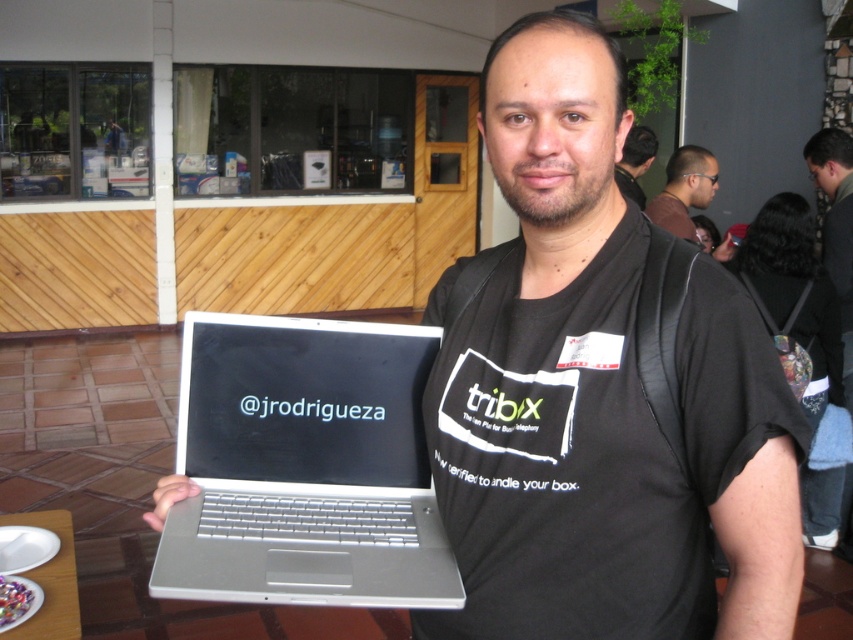
Question: Based on their relative distances, which object is nearer to the black fabric backpack at upper right?

Choices:
 (A) black matte laptop at center
 (B) matte black laptop at upper center
 (C) silver metallic laptop at center

Answer: (B)

Question: Does black fabric backpack at upper right lie in front of black matte laptop at center?

Choices:
 (A) yes
 (B) no

Answer: (A)

Question: Can you confirm if silver metallic laptop at center is positioned above matte black laptop at upper center?

Choices:
 (A) no
 (B) yes

Answer: (A)

Question: In this image, where is matte black laptop at upper center located relative to black matte laptop at center?

Choices:
 (A) right
 (B) left

Answer: (A)

Question: Estimate the real-world distances between objects in this image. Which object is closer to the matte black laptop at upper center?

Choices:
 (A) black fabric backpack at upper right
 (B) black matte laptop at center

Answer: (B)

Question: Which object is closer to the camera taking this photo?

Choices:
 (A) black matte laptop at center
 (B) black fabric backpack at upper right
 (C) silver metallic laptop at center

Answer: (C)